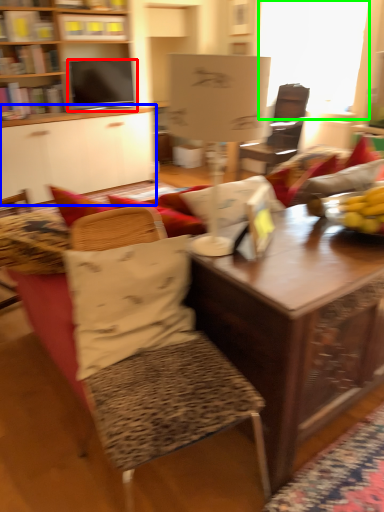
Question: Which object is the farthest from television (highlighted by a red box)? Choose among these: desk (highlighted by a blue box) or window screen (highlighted by a green box).

Choices:
 (A) desk
 (B) window screen

Answer: (B)